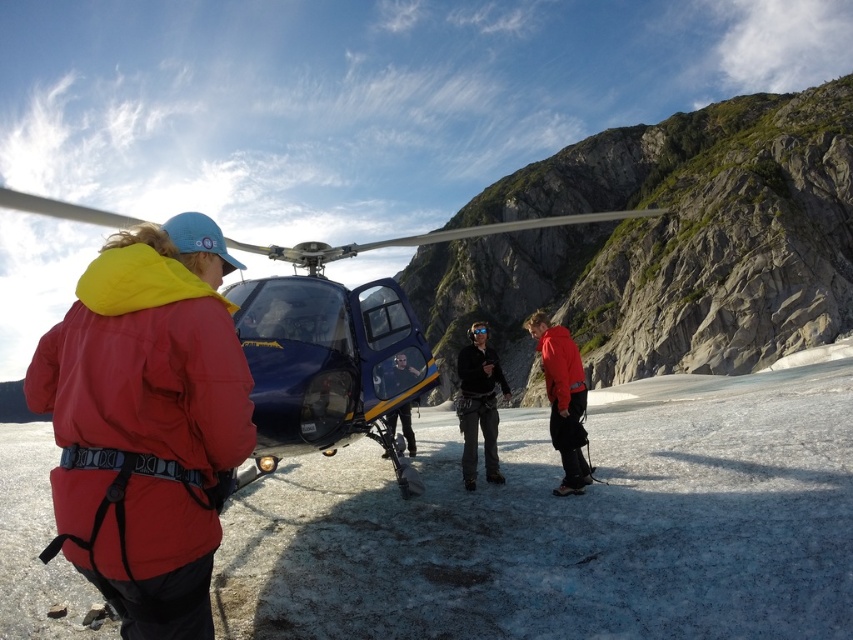
Based on the photo, you are a photographer planning to take a photo of the blue metallic helicopter at center. The camera has a fixed focus point at coordinate point (339, 346). Will the helicopter be in focus?

Yes, the blue metallic helicopter at center is located exactly at point (339, 346), so the camera will capture it in focus.

Based on the scene description, where is the blue metallic helicopter at center located in the image?

The blue metallic helicopter at center is located at point (339,346) in the image.